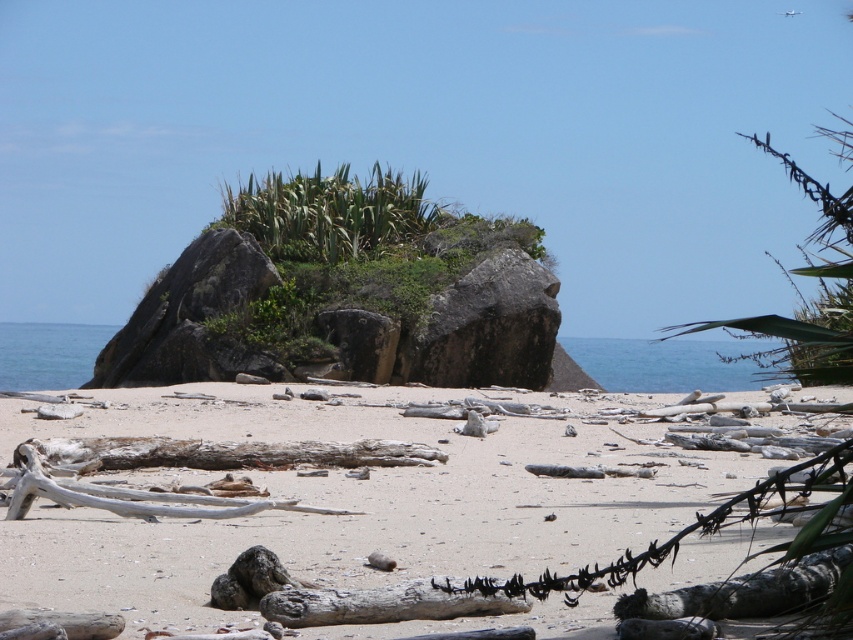
Question: Considering the real-world distances, which object is farthest from the gray weathered log at center?

Choices:
 (A) charcoal textured log at lower right
 (B) blue water at lower left

Answer: (B)

Question: Which of the following is the closest to the observer?

Choices:
 (A) charcoal textured log at lower right
 (B) gray weathered log at center

Answer: (A)

Question: Can you confirm if gray weathered log at center is positioned to the left of blue water at lower left?

Choices:
 (A) no
 (B) yes

Answer: (A)

Question: Which of the following is the farthest from the observer?

Choices:
 (A) (601, 384)
 (B) (61, 339)
 (C) (282, 243)

Answer: (B)

Question: Is white sandy beach at center further to the viewer compared to gray weathered log at center?

Choices:
 (A) yes
 (B) no

Answer: (B)

Question: Does white sandy beach at center have a lesser width compared to charcoal textured log at lower right?

Choices:
 (A) no
 (B) yes

Answer: (A)